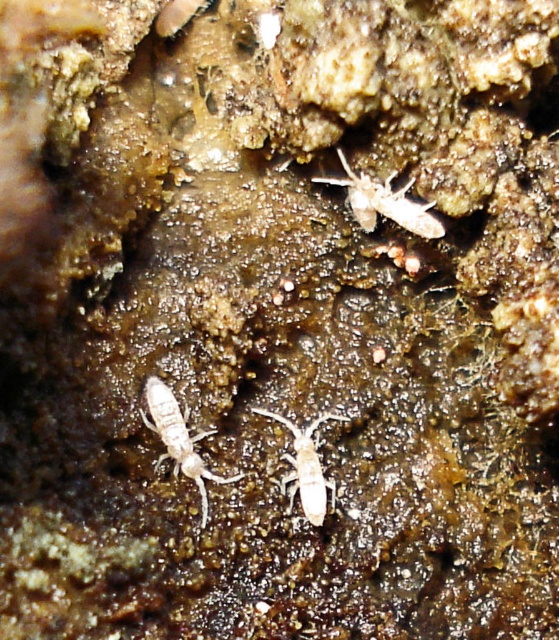
Question: Which object is the farthest from the white matte insect at center?

Choices:
 (A) translucent white insect at upper right
 (B) white matte insect at lower left

Answer: (A)

Question: Estimate the real-world distances between objects in this image. Which object is farther from the white matte insect at lower left?

Choices:
 (A) translucent white insect at upper right
 (B) white matte insect at center

Answer: (A)

Question: Does translucent white insect at upper right have a larger size compared to white matte insect at lower left?

Choices:
 (A) yes
 (B) no

Answer: (B)

Question: Which point is closer to the camera?

Choices:
 (A) (440, 230)
 (B) (165, 456)

Answer: (A)

Question: Is white matte insect at lower left to the right of white matte insect at center from the viewer's perspective?

Choices:
 (A) yes
 (B) no

Answer: (B)

Question: Is translucent white insect at upper right to the right of white matte insect at lower left from the viewer's perspective?

Choices:
 (A) yes
 (B) no

Answer: (A)